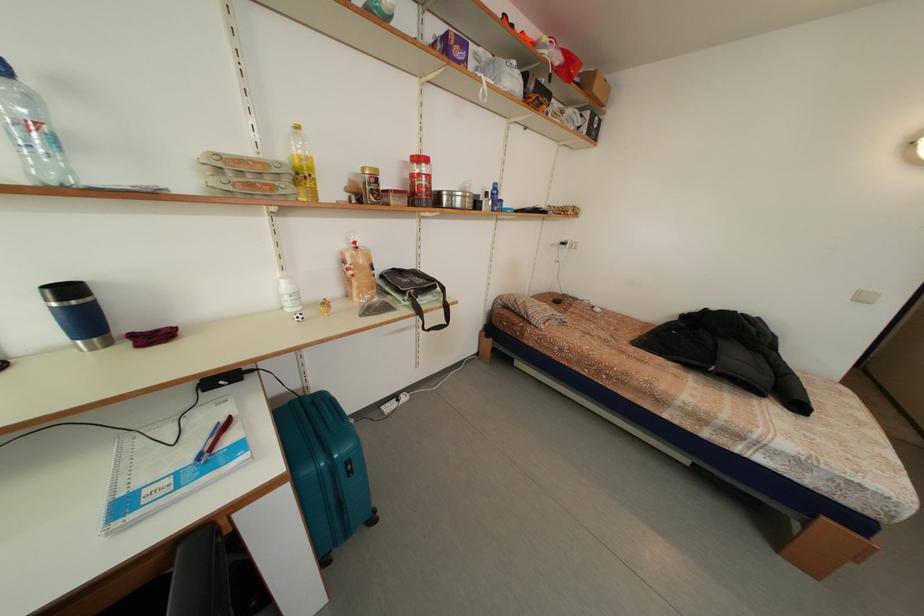
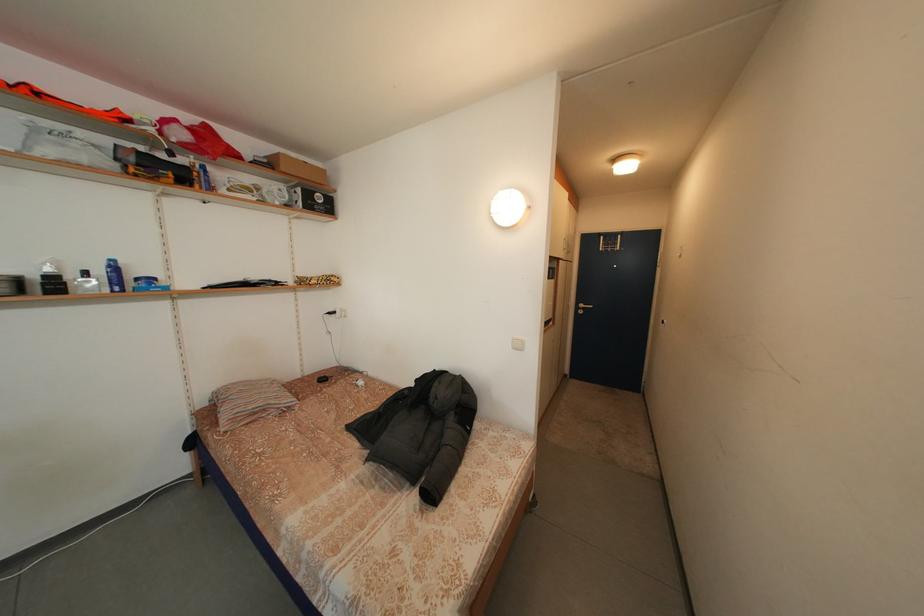
Question: What movement of the cameraman would produce the second image?

Choices:
 (A) Left
 (B) Right
 (C) Forward
 (D) Backward

Answer: (B)